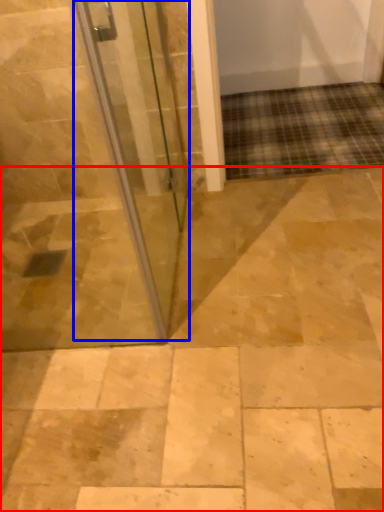
Question: Which point is closer to the camera, path (highlighted by a red box) or door (highlighted by a blue box)?

Choices:
 (A) path
 (B) door

Answer: (B)